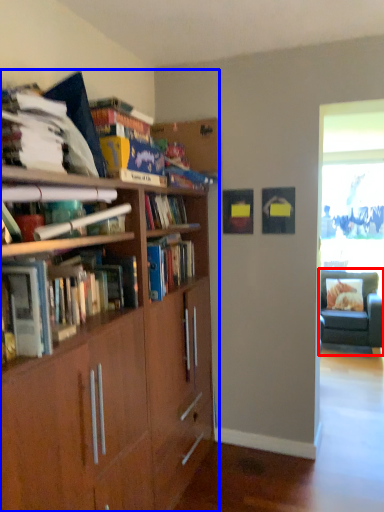
Question: Which object appears farthest to the camera in this image, chair (highlighted by a red box) or bookcase (highlighted by a blue box)?

Choices:
 (A) chair
 (B) bookcase

Answer: (A)